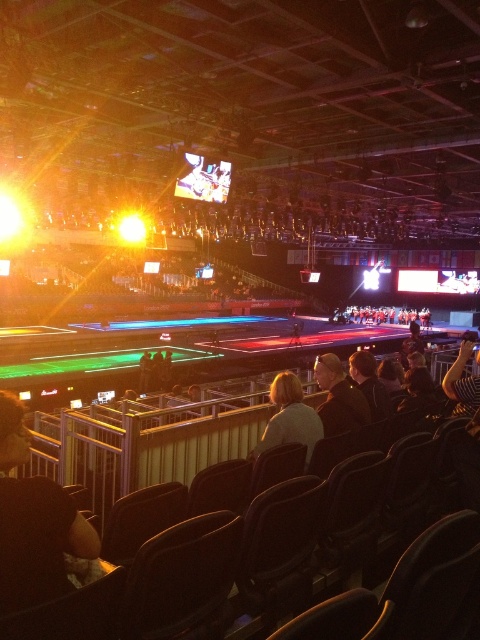
Does light brown leather jacket at center have a greater height compared to black leather jacket at center?

Yes.

Does point (257, 449) lie behind point (315, 371)?

No, (257, 449) is in front of (315, 371).

Locate an element on the screen. The height and width of the screenshot is (640, 480). light brown leather jacket at center is located at coordinates (289, 417).

This screenshot has width=480, height=640. Identify the location of light brown leather jacket at center. (289, 417).

Which is below, dark brown leather jacket at lower left or light brown leather jacket at center?

Positioned lower is light brown leather jacket at center.

Can you confirm if dark brown leather jacket at lower left is positioned above light brown leather jacket at center?

Correct, dark brown leather jacket at lower left is located above light brown leather jacket at center.

Is point (6, 518) farther from camera compared to point (262, 449)?

No, it is in front of (262, 449).

Find the location of a particular element. The height and width of the screenshot is (640, 480). dark brown leather jacket at lower left is located at coordinates (38, 541).

Is dark brown leather jacket at lower left closer to camera compared to black leather jacket at center?

Yes, it is in front of black leather jacket at center.

Does point (60, 525) come closer to viewer compared to point (327, 410)?

Yes.

Between point (0, 548) and point (327, 413), which one is positioned in front?

Point (0, 548)

The image size is (480, 640). What are the coordinates of `dark brown leather jacket at lower left` in the screenshot? It's located at (38, 541).